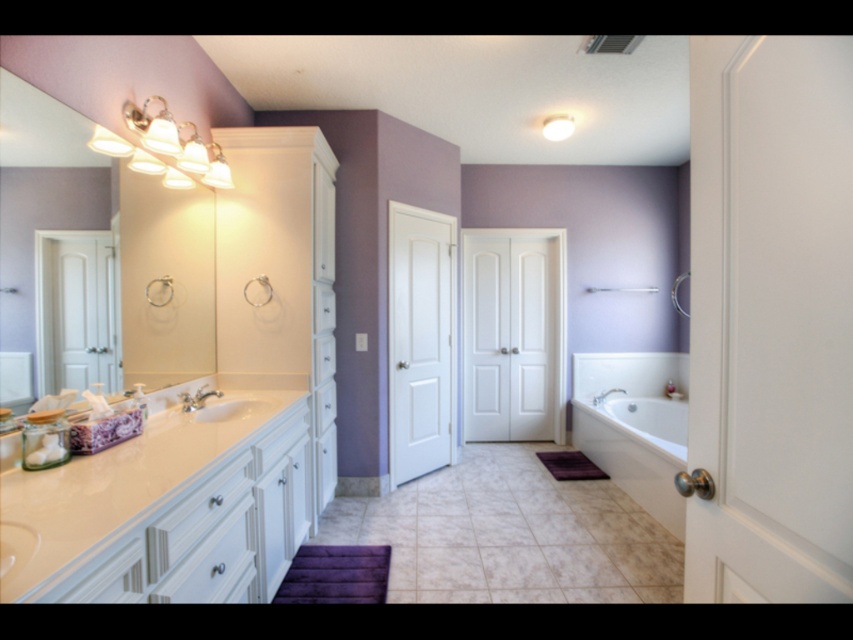
Question: Is white glossy bathtub at right above white glossy sink at center?

Choices:
 (A) no
 (B) yes

Answer: (A)

Question: Does white glossy bathtub at right have a smaller size compared to silver metallic faucet at lower right?

Choices:
 (A) no
 (B) yes

Answer: (A)

Question: Can you confirm if white glossy vanity at lower left is positioned to the right of white glossy sink at center?

Choices:
 (A) yes
 (B) no

Answer: (A)

Question: Among these objects, which one is farthest from the camera?

Choices:
 (A) matte silver faucet at lower left
 (B) silver metallic faucet at lower right
 (C) white glossy vanity at lower left

Answer: (B)

Question: Which point is closer to the camera?

Choices:
 (A) white glossy shower at center
 (B) white glossy bathtub at right
 (C) white glossy vanity at lower left
 (D) silver metallic faucet at lower right

Answer: (C)

Question: Among these points, which one is farthest from the camera?

Choices:
 (A) (616, 461)
 (B) (614, 289)
 (C) (194, 394)
 (D) (260, 403)

Answer: (B)